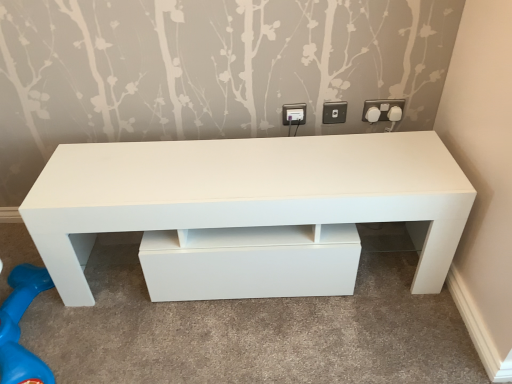
Question: Considering the positions of white plastic socket at upper right, placed as the 2th electric outlet when sorted from right to left, and white plastic knob at upper right, the first knob from the right, in the image, is white plastic socket at upper right, placed as the 2th electric outlet when sorted from right to left, wider or thinner than white plastic knob at upper right, the first knob from the right,?

Choices:
 (A) wide
 (B) thin

Answer: (B)

Question: Is point (324, 109) positioned closer to the camera than point (391, 117)?

Choices:
 (A) closer
 (B) farther

Answer: (A)

Question: Which object is the farthest from the white plastic socket at upper right, placed as the 2th electric outlet when sorted from right to left?

Choices:
 (A) white plastic socket at upper right, which is the 3th electric outlet in left-to-right order
 (B) white plastic knob at upper right, the first knob from the right
 (C) white plastic electric outlet at upper center, the 3th electric outlet viewed from the right
 (D) white glossy table at center
 (E) white plastic knob at upper right, which appears as the first knob when viewed from the left

Answer: (D)

Question: Which is nearer to the white plastic socket at upper right, the second electric outlet viewed from the left?

Choices:
 (A) white plastic socket at upper right, acting as the first electric outlet starting from the right
 (B) white plastic knob at upper right, the first knob from the right
 (C) white plastic knob at upper right, which appears as the first knob when viewed from the left
 (D) white plastic electric outlet at upper center, the 3th electric outlet viewed from the right
 (E) white glossy table at center

Answer: (D)